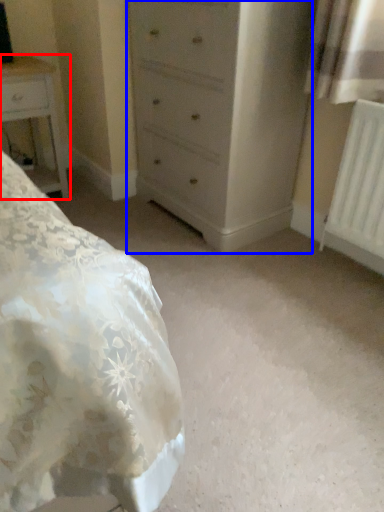
Question: Which of the following is the closest to the observer, nightstand (highlighted by a red box) or chest of drawers (highlighted by a blue box)?

Choices:
 (A) nightstand
 (B) chest of drawers

Answer: (B)